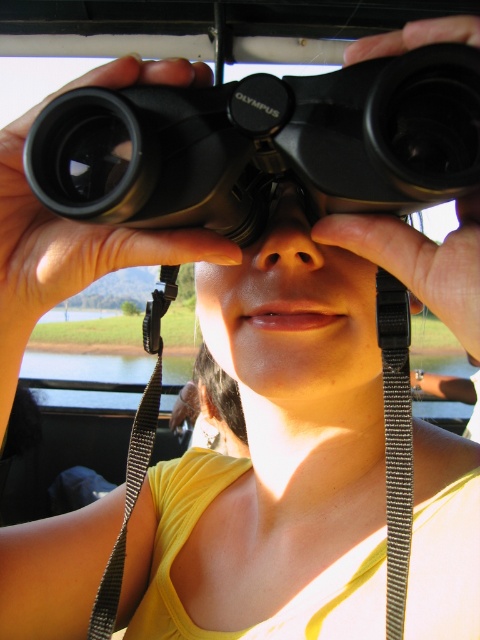
Question: Which of the following is the farthest from the observer?

Choices:
 (A) black textured strap at center
 (B) black rubber binoculars at center

Answer: (A)

Question: Which of the following is the closest to the observer?

Choices:
 (A) (192, 156)
 (B) (411, 497)

Answer: (A)

Question: Does black rubber binoculars at center appear on the left side of black textured strap at center?

Choices:
 (A) yes
 (B) no

Answer: (A)

Question: Does black rubber binoculars at center come behind black textured strap at center?

Choices:
 (A) no
 (B) yes

Answer: (A)

Question: Is black rubber binoculars at center positioned in front of black textured strap at center?

Choices:
 (A) no
 (B) yes

Answer: (B)